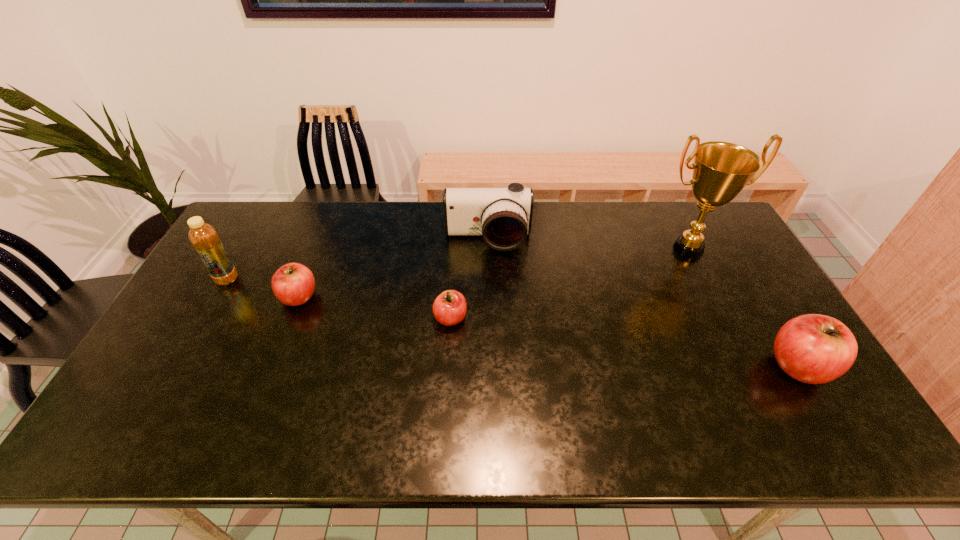
You are a GUI agent. You are given a task and a screenshot of the screen. Output one action in this format:
    pyautogui.click(x=<x>, y=<y>)
    Task: Click on the apple at the right edge
    
    Given the screenshot: What is the action you would take?
    pyautogui.click(x=815, y=349)

This screenshot has height=540, width=960. I want to click on award positioned at the right edge, so click(x=721, y=170).

Locate an element on the screen. object present at the far right corner is located at coordinates (721, 170).

Identify the location of object at the near right corner. This screenshot has height=540, width=960. (815, 349).

Find the location of a particular element. vacant space at the far edge of the desktop is located at coordinates (558, 225).

Locate an element on the screen. The height and width of the screenshot is (540, 960). vacant region at the near edge is located at coordinates (658, 378).

You are a GUI agent. You are given a task and a screenshot of the screen. Output one action in this format:
    pyautogui.click(x=<x>, y=<y>)
    Task: Click on the vacant space at the left edge of the desktop
    This screenshot has height=540, width=960.
    Given the screenshot: What is the action you would take?
    point(213,347)

I want to click on free space at the right edge, so click(x=763, y=347).

This screenshot has width=960, height=540. In the image, there is a desktop. What are the coordinates of `vacant space at the far left corner` in the screenshot? It's located at (252, 218).

Where is `vacant space at the far right corner of the desktop`? vacant space at the far right corner of the desktop is located at coordinates (732, 236).